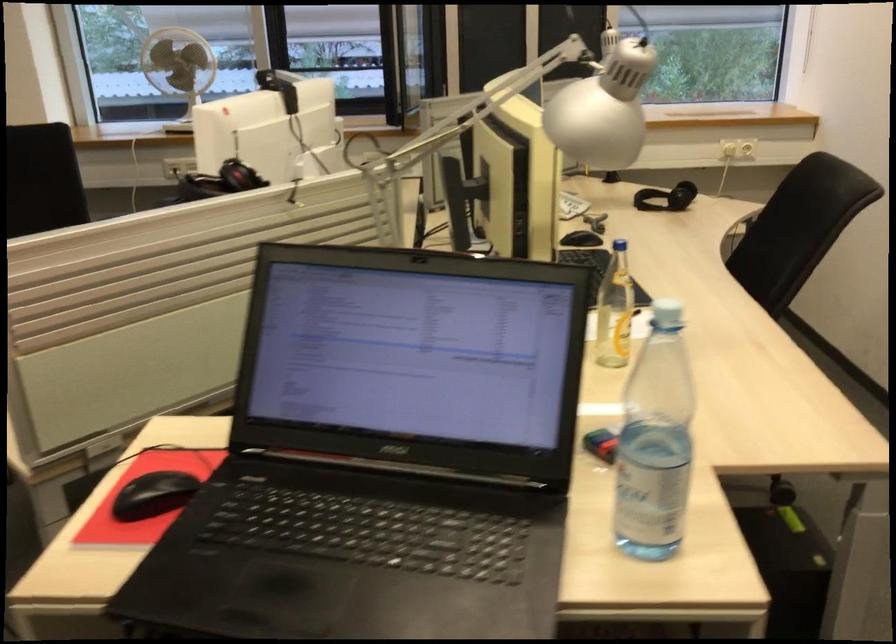
I want to click on silver lamp head, so click(x=604, y=109).